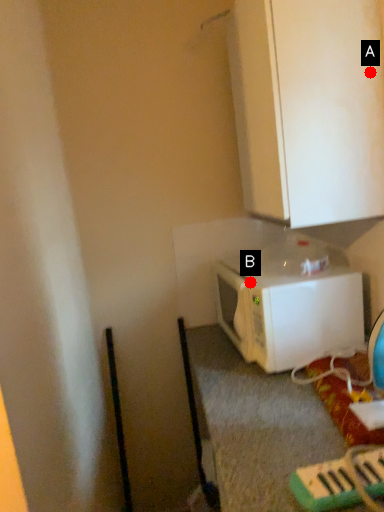
Question: Two points are circled on the image, labeled by A and B beside each circle. Which of the following is the closest to the observer?

Choices:
 (A) A is closer
 (B) B is closer

Answer: (A)